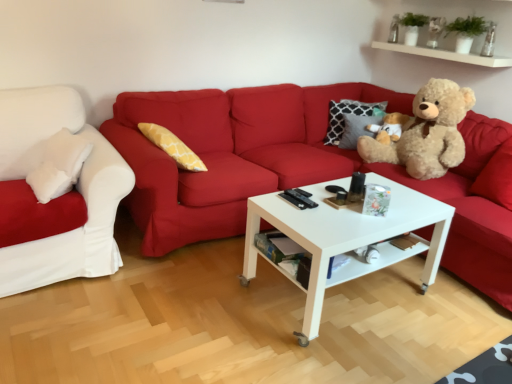
The image size is (512, 384). Find the location of `free space in front of white glossy coffee table at center`. free space in front of white glossy coffee table at center is located at coordinates (353, 352).